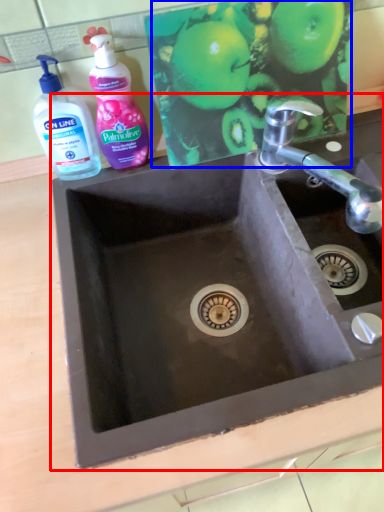
Question: Which object is closer to the camera taking this photo, sink (highlighted by a red box) or apple (highlighted by a blue box)?

Choices:
 (A) sink
 (B) apple

Answer: (A)